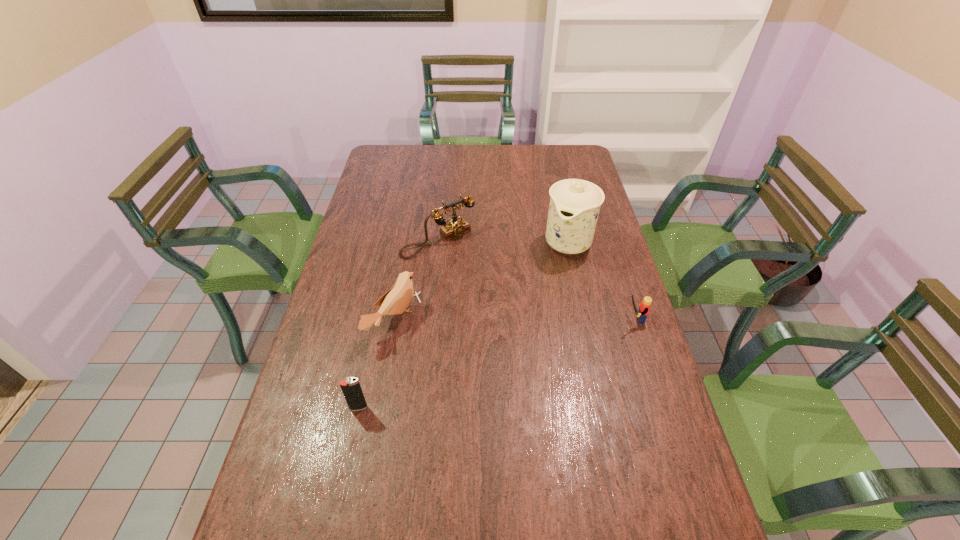
The height and width of the screenshot is (540, 960). In order to click on the nearest object in this screenshot , I will do `click(351, 388)`.

At what (x,y) coordinates should I click in order to perform the action: click on the rightmost object. Please return your answer as a coordinate pair (x, y). The height and width of the screenshot is (540, 960). Looking at the image, I should click on (644, 308).

Where is `telephone`? telephone is located at coordinates (456, 227).

The image size is (960, 540). In order to click on chinaware in this screenshot , I will do `click(574, 207)`.

Find the location of a particular element. the fourth object from left to right is located at coordinates 574,207.

In order to click on bird in this screenshot , I will do `click(395, 301)`.

You are a GUI agent. You are given a task and a screenshot of the screen. Output one action in this format:
    pyautogui.click(x=<x>, y=<y>)
    Task: Click on the vacant space located on the back of the igniter
    This screenshot has width=960, height=540.
    Given the screenshot: What is the action you would take?
    pyautogui.click(x=366, y=373)

This screenshot has height=540, width=960. In order to click on free spot located 0.160m on the front-facing side of the rightmost object in this screenshot , I will do `click(565, 319)`.

Find the location of a particular element. free spot located 0.250m on the front-facing side of the rightmost object is located at coordinates (535, 319).

Locate an element on the screen. Image resolution: width=960 pixels, height=540 pixels. free location located 0.190m on the front-facing side of the rightmost object is located at coordinates (555, 319).